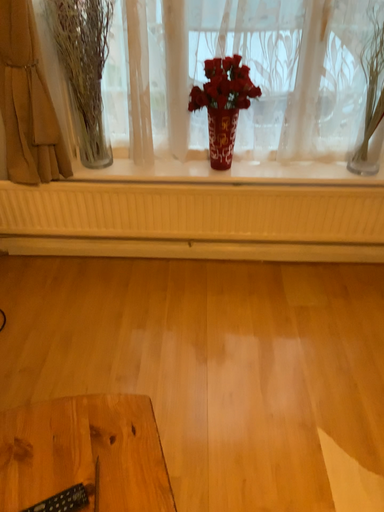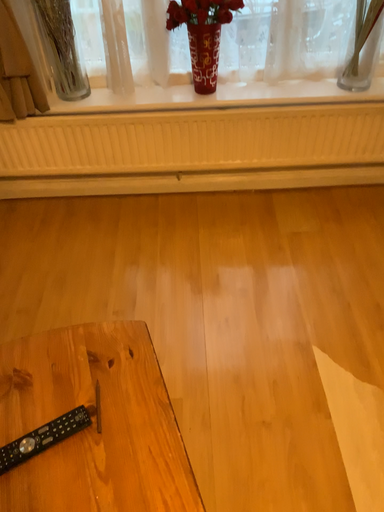
Question: How did the camera likely rotate when shooting the video?

Choices:
 (A) rotated downward
 (B) rotated upward

Answer: (A)